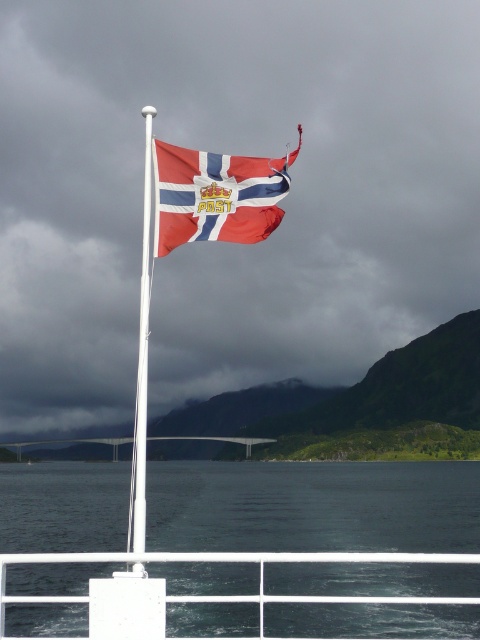
Question: From the image, what is the correct spatial relationship of dark blue water at center in relation to white metallic flag pole at upper center?

Choices:
 (A) below
 (B) above

Answer: (A)

Question: Which of these objects is positioned closest to the white metallic flag pole at upper center?

Choices:
 (A) dark blue water at center
 (B) matte fabric flag at center

Answer: (B)

Question: Is dark blue water at center closer to camera compared to matte fabric flag at center?

Choices:
 (A) no
 (B) yes

Answer: (B)

Question: Which point appears farthest from the camera in this image?

Choices:
 (A) (147, 216)
 (B) (182, 572)

Answer: (B)

Question: Which of these objects is positioned farthest from the dark blue water at center?

Choices:
 (A) white metallic flag pole at upper center
 (B) matte fabric flag at center

Answer: (B)

Question: Is matte fabric flag at center bigger than white metallic flag pole at upper center?

Choices:
 (A) yes
 (B) no

Answer: (B)